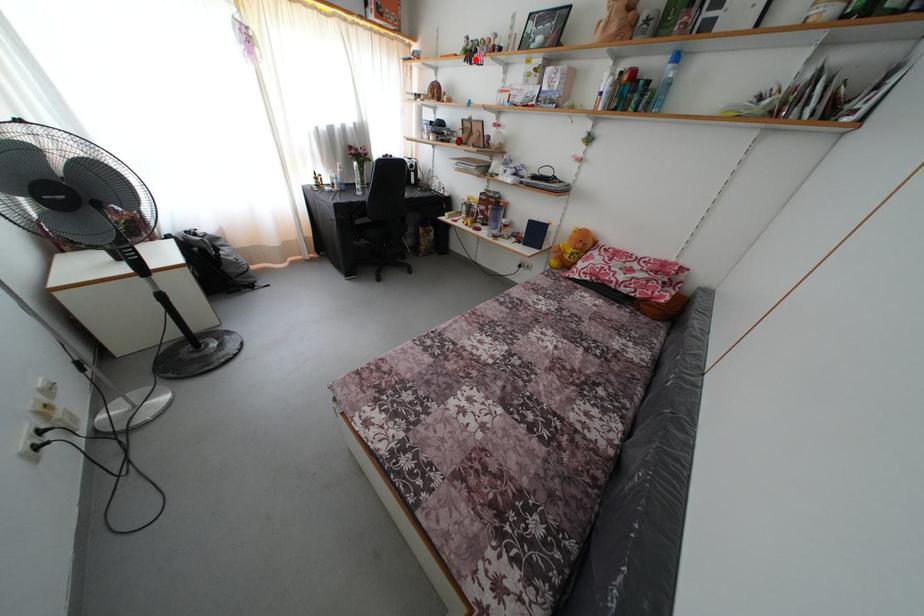
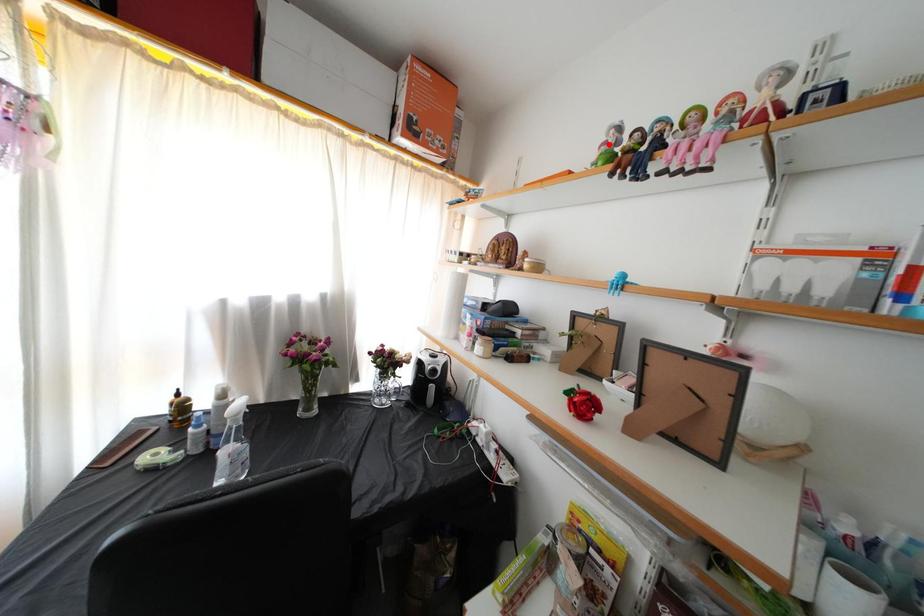
I am providing you with two images of the same scene from different viewpoints. A red point is marked on the first image and another point is marked on the second image. Does the point marked in image1 correspond to the same location as the one in image2?

No